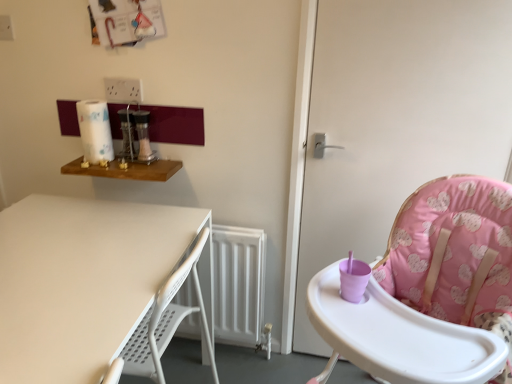
Question: From the image's perspective, is wooden shelf at upper left, positioned as the 2th table in bottom-to-top order, above or below pink fabric high chair at right?

Choices:
 (A) above
 (B) below

Answer: (A)

Question: Considering the relative positions of wooden shelf at upper left, positioned as the 2th table in bottom-to-top order, and pink fabric high chair at right in the image provided, is wooden shelf at upper left, positioned as the 2th table in bottom-to-top order, to the left or to the right of pink fabric high chair at right?

Choices:
 (A) left
 (B) right

Answer: (A)

Question: Considering the real-world distances, which object is closest to the wooden shelf at upper left, which ranks as the 1th table in top-to-bottom order?

Choices:
 (A) white paper towel at upper left
 (B) pink fabric highchair at right
 (C) pink fabric high chair at right
 (D) white matte table at lower left, which is the first table in bottom-to-top order

Answer: (A)

Question: Considering the real-world distances, which object is closest to the pink fabric highchair at right?

Choices:
 (A) white paper towel at upper left
 (B) pink fabric high chair at right
 (C) white matte table at lower left, which is the first table in bottom-to-top order
 (D) wooden shelf at upper left, which ranks as the 1th table in top-to-bottom order

Answer: (B)